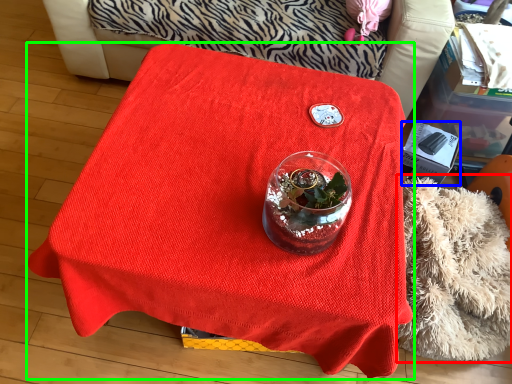
Question: Estimate the real-world distances between objects in this image. Which object is farther from blanket (highlighted by a red box), box (highlighted by a blue box) or table (highlighted by a green box)?

Choices:
 (A) box
 (B) table

Answer: (B)